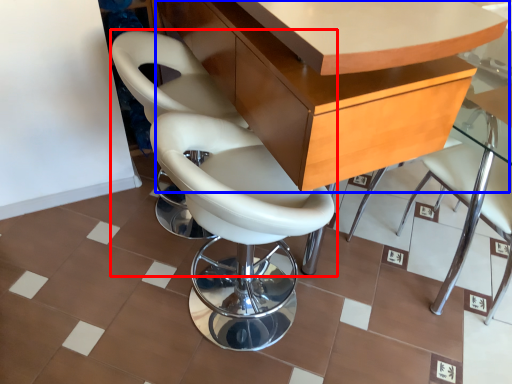
Question: Which point is further to the camera, chair (highlighted by a red box) or table (highlighted by a blue box)?

Choices:
 (A) chair
 (B) table

Answer: (A)